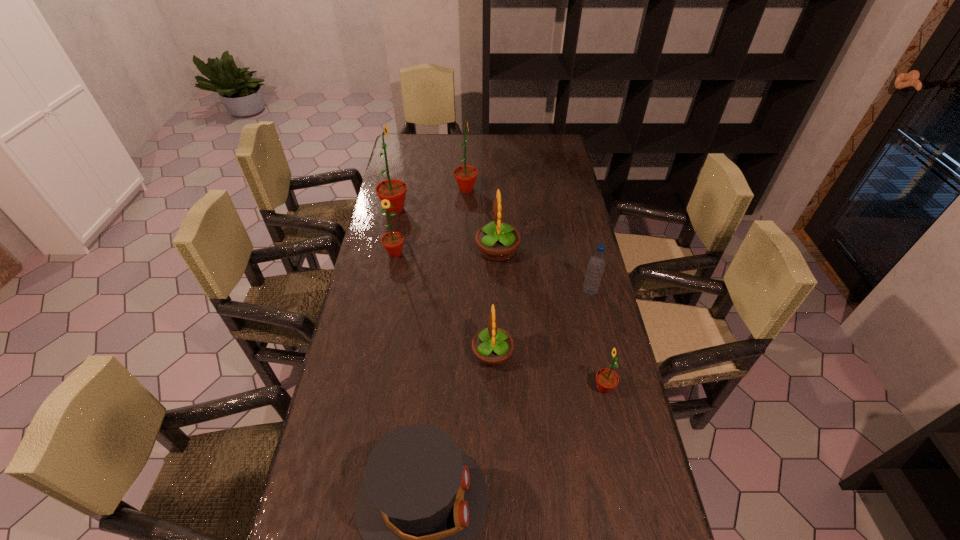
Locate an element on the screen. The image size is (960, 540). the tallest sunflower is located at coordinates click(394, 190).

What are the coordinates of `the second farthest object` in the screenshot? It's located at 394,190.

Identify the location of the farthest object. Image resolution: width=960 pixels, height=540 pixels. (465, 175).

Locate an element on the screen. This screenshot has height=540, width=960. the third green sunflower from left to right is located at coordinates (465, 175).

Where is `the farther yellow sunflower`? The height and width of the screenshot is (540, 960). the farther yellow sunflower is located at coordinates (497, 242).

Identify the location of the third farthest green sunflower. [x=393, y=242].

Find the location of `blue water bottle`. blue water bottle is located at coordinates (596, 264).

Where is `the fourth nearest object`? The image size is (960, 540). the fourth nearest object is located at coordinates (596, 264).

At what (x,y) coordinates should I click in order to perform the action: click on the fifth farthest sunflower. Please return your answer as a coordinate pair (x, y). Looking at the image, I should click on (492, 346).

Identify the location of the third nearest object. (492, 346).